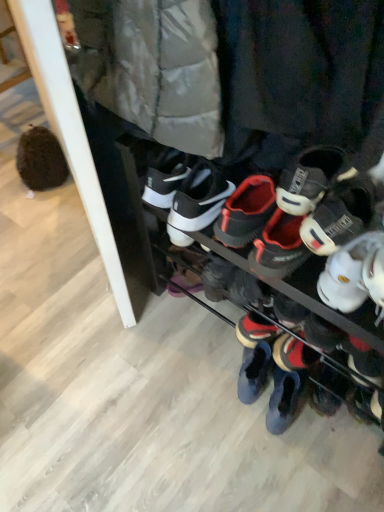
This screenshot has height=512, width=384. I want to click on black matte sneakers at center, which is counted as the third footwear, starting from the back, so click(x=330, y=323).

The image size is (384, 512). I want to click on black suede sneaker at lower right, the third footwear from the front, so click(363, 405).

Image resolution: width=384 pixels, height=512 pixels. What do you see at coordinates (354, 274) in the screenshot? I see `white matte sneaker at right, which is counted as the second footwear, starting from the front` at bounding box center [354, 274].

Find the location of `black matte sneakers at center, which is counted as the third footwear, starting from the back`. black matte sneakers at center, which is counted as the third footwear, starting from the back is located at coordinates (330, 323).

Is white matte sneaker at right, which is counted as the second footwear, starting from the front, positioned far away from black matte sneakers at center, the first footwear in the front-to-back sequence?

No, white matte sneaker at right, which is counted as the second footwear, starting from the front, is in close proximity to black matte sneakers at center, the first footwear in the front-to-back sequence.

From the image's perspective, which is below, white matte sneaker at right, which is counted as the second footwear, starting from the front, or black matte sneakers at center, the first footwear in the front-to-back sequence?

black matte sneakers at center, the first footwear in the front-to-back sequence.

Is white matte sneaker at right, which is counted as the second footwear, starting from the front, not within black matte sneakers at center, which is counted as the third footwear, starting from the back?

No.

Considering the sizes of objects white matte sneaker at right, acting as the second footwear starting from the back, and black matte sneakers at center, which is counted as the third footwear, starting from the back, in the image provided, who is wider, white matte sneaker at right, acting as the second footwear starting from the back, or black matte sneakers at center, which is counted as the third footwear, starting from the back,?

With larger width is white matte sneaker at right, acting as the second footwear starting from the back.

Is black suede sneaker at lower right, the third footwear from the front, positioned far away from white matte sneaker at right, acting as the second footwear starting from the back?

black suede sneaker at lower right, the third footwear from the front, is actually quite close to white matte sneaker at right, acting as the second footwear starting from the back.

Considering the points (358, 406) and (354, 285), which point is behind, point (358, 406) or point (354, 285)?

Positioned behind is point (358, 406).

Does black suede sneaker at lower right, which is the first footwear in back-to-front order, come behind white matte sneaker at right, which is counted as the second footwear, starting from the front?

That is True.

From the black suede sneaker at lower right, which is the first footwear in back-to-front order, count the 1st footwear to the left and point to it. Please provide its 2D coordinates.

[(354, 274)]

In the scene shown: Choose the correct answer: Is white matte sneaker at right, which is counted as the second footwear, starting from the front, inside black suede sneaker at lower right, which is the first footwear in back-to-front order, or outside it?

white matte sneaker at right, which is counted as the second footwear, starting from the front, is spatially situated outside black suede sneaker at lower right, which is the first footwear in back-to-front order.

From the image's perspective, between white matte sneaker at right, which is counted as the second footwear, starting from the front, and black suede sneaker at lower right, which is the first footwear in back-to-front order, which one is located above?

white matte sneaker at right, which is counted as the second footwear, starting from the front, from the image's perspective.

Consider the image. In the image, is white matte sneaker at right, which is counted as the second footwear, starting from the front, positioned in front of or behind black suede sneaker at lower right, the third footwear from the front?

white matte sneaker at right, which is counted as the second footwear, starting from the front, is in front of black suede sneaker at lower right, the third footwear from the front.

Identify the location of the 2nd footwear counting from the left of the black suede sneaker at lower right, the third footwear from the front. (330, 323).

Is black suede sneaker at lower right, which is the first footwear in back-to-front order, inside or outside of black matte sneakers at center, the first footwear in the front-to-back sequence?

black suede sneaker at lower right, which is the first footwear in back-to-front order, exists entirely within black matte sneakers at center, the first footwear in the front-to-back sequence.

Are black suede sneaker at lower right, the third footwear from the front, and black matte sneakers at center, the first footwear in the front-to-back sequence, making contact?

No, black suede sneaker at lower right, the third footwear from the front, is not beside black matte sneakers at center, the first footwear in the front-to-back sequence.

Considering the positions of objects black suede sneaker at lower right, which is the first footwear in back-to-front order, and black matte sneakers at center, which is counted as the third footwear, starting from the back, in the image provided, who is more to the left, black suede sneaker at lower right, which is the first footwear in back-to-front order, or black matte sneakers at center, which is counted as the third footwear, starting from the back,?

From the viewer's perspective, black matte sneakers at center, which is counted as the third footwear, starting from the back, appears more on the left side.

Consider the image. Which is closer, (x=314, y=314) or (x=357, y=415)?

Point (x=314, y=314) is closer to the camera than point (x=357, y=415).

From the image's perspective, relative to black suede sneaker at lower right, the third footwear from the front, is black matte sneakers at center, which is counted as the third footwear, starting from the back, above or below?

Clearly, from the image's perspective, black matte sneakers at center, which is counted as the third footwear, starting from the back, is above black suede sneaker at lower right, the third footwear from the front.

Considering the sizes of objects black matte sneakers at center, which is counted as the third footwear, starting from the back, and black suede sneaker at lower right, the third footwear from the front, in the image provided, who is shorter, black matte sneakers at center, which is counted as the third footwear, starting from the back, or black suede sneaker at lower right, the third footwear from the front,?

black suede sneaker at lower right, the third footwear from the front.

From a real-world perspective, is black matte sneakers at center, the first footwear in the front-to-back sequence, positioned above or below black suede sneaker at lower right, the third footwear from the front?

From a real-world perspective, black matte sneakers at center, the first footwear in the front-to-back sequence, is physically above black suede sneaker at lower right, the third footwear from the front.

Is point (324, 313) behind point (340, 271)?

Yes, point (324, 313) is farther from viewer.

In terms of width, does black matte sneakers at center, the first footwear in the front-to-back sequence, look wider or thinner when compared to white matte sneaker at right, which is counted as the second footwear, starting from the front?

black matte sneakers at center, the first footwear in the front-to-back sequence, is thinner than white matte sneaker at right, which is counted as the second footwear, starting from the front.

From the image's perspective, is black matte sneakers at center, which is counted as the third footwear, starting from the back, positioned above or below white matte sneaker at right, which is counted as the second footwear, starting from the front?

Clearly, from the image's perspective, black matte sneakers at center, which is counted as the third footwear, starting from the back, is below white matte sneaker at right, which is counted as the second footwear, starting from the front.

Identify the location of footwear in front of the white matte sneaker at right, which is counted as the second footwear, starting from the front. This screenshot has height=512, width=384. (330, 323).

From a real-world perspective, which footwear is the 2nd one above the black suede sneaker at lower right, which is the first footwear in back-to-front order? Please provide its 2D coordinates.

[(354, 274)]

Estimate the real-world distances between objects in this image. Which object is further from white matte sneaker at right, acting as the second footwear starting from the back, black suede sneaker at lower right, which is the first footwear in back-to-front order, or black matte sneakers at center, the first footwear in the front-to-back sequence?

black suede sneaker at lower right, which is the first footwear in back-to-front order, is positioned further to the anchor white matte sneaker at right, acting as the second footwear starting from the back.

Based on their spatial positions, is white matte sneaker at right, acting as the second footwear starting from the back, or black matte sneakers at center, which is counted as the third footwear, starting from the back, further from black suede sneaker at lower right, the third footwear from the front?

Based on the image, white matte sneaker at right, acting as the second footwear starting from the back, appears to be further to black suede sneaker at lower right, the third footwear from the front.

Looking at the image, which one is located closer to white matte sneaker at right, which is counted as the second footwear, starting from the front, black matte sneakers at center, the first footwear in the front-to-back sequence, or black suede sneaker at lower right, the third footwear from the front?

Among the two, black matte sneakers at center, the first footwear in the front-to-back sequence, is located nearer to white matte sneaker at right, which is counted as the second footwear, starting from the front.

When comparing their distances from black matte sneakers at center, which is counted as the third footwear, starting from the back, does white matte sneaker at right, acting as the second footwear starting from the back, or black suede sneaker at lower right, the third footwear from the front, seem further?

black suede sneaker at lower right, the third footwear from the front, lies further to black matte sneakers at center, which is counted as the third footwear, starting from the back, than the other object.

When comparing their distances from black suede sneaker at lower right, which is the first footwear in back-to-front order, does black matte sneakers at center, the first footwear in the front-to-back sequence, or white matte sneaker at right, which is counted as the second footwear, starting from the front, seem closer?

black matte sneakers at center, the first footwear in the front-to-back sequence, is positioned closer to the anchor black suede sneaker at lower right, which is the first footwear in back-to-front order.

When comparing their distances from black matte sneakers at center, which is counted as the third footwear, starting from the back, does black suede sneaker at lower right, the third footwear from the front, or white matte sneaker at right, which is counted as the second footwear, starting from the front, seem further?

black suede sneaker at lower right, the third footwear from the front, lies further to black matte sneakers at center, which is counted as the third footwear, starting from the back, than the other object.

Identify the location of footwear between black matte sneakers at center, which is counted as the third footwear, starting from the back, and black suede sneaker at lower right, the third footwear from the front, in the front-back direction. Image resolution: width=384 pixels, height=512 pixels. (354, 274).